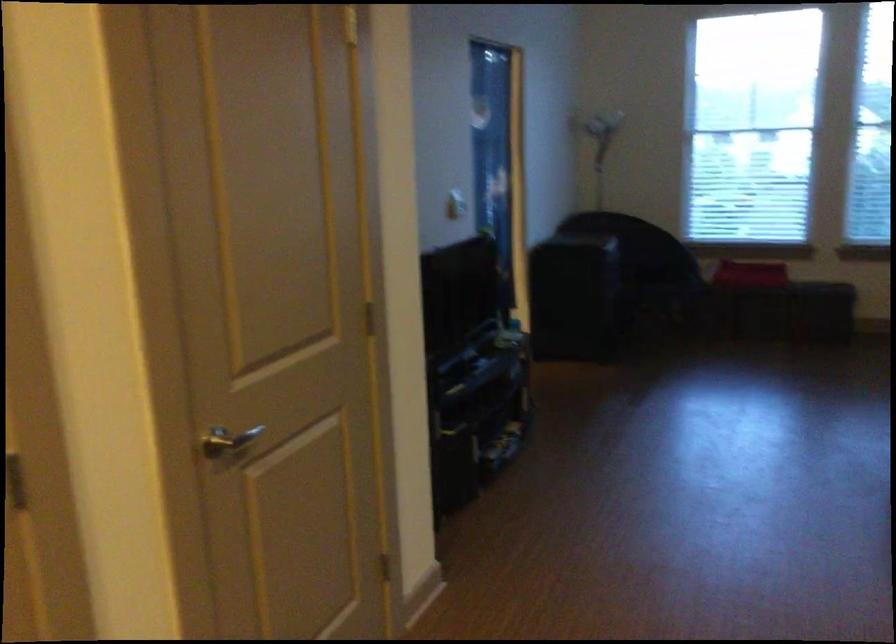
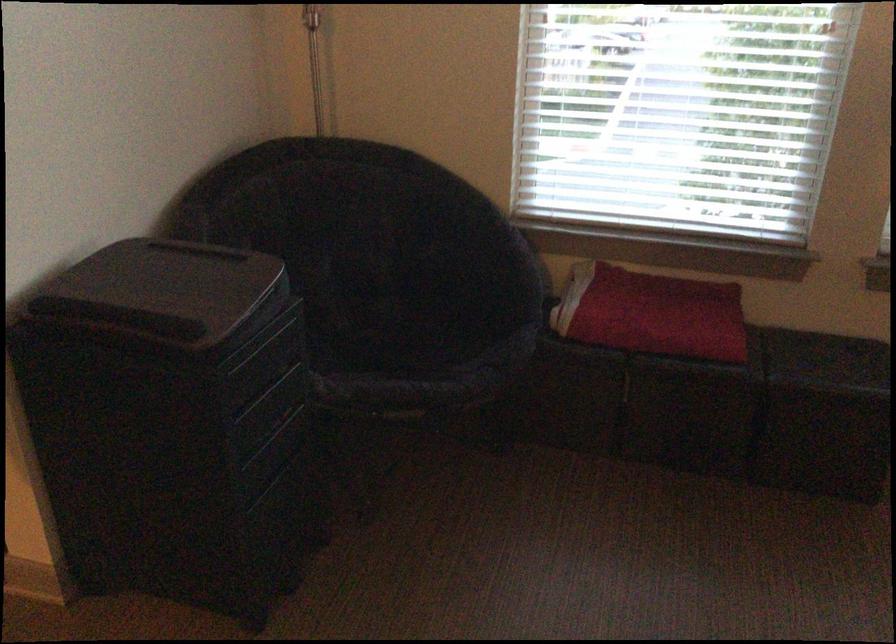
The point at (633, 274) is marked in the first image. Where is the corresponding point in the second image?

(393, 339)